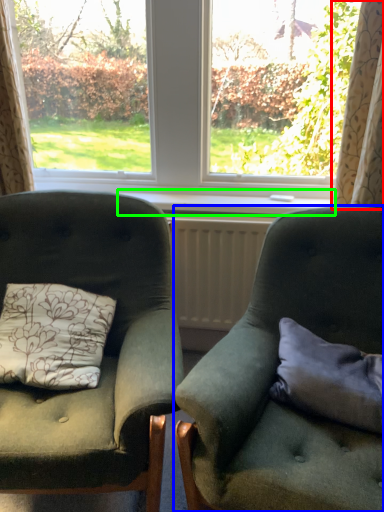
Question: Which is farther away from curtain (highlighted by a red box)? chair (highlighted by a blue box) or window sill (highlighted by a green box)?

Choices:
 (A) chair
 (B) window sill

Answer: (A)